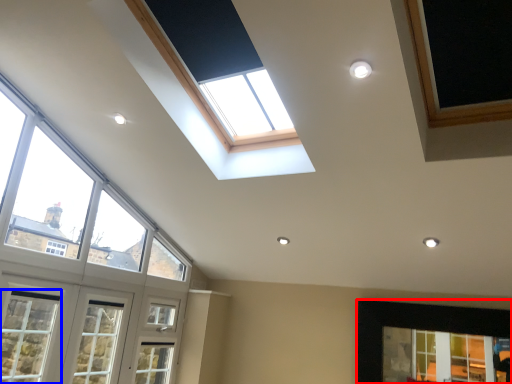
Question: Which point is closer to the camera, window (highlighted by a red box) or window (highlighted by a blue box)?

Choices:
 (A) window
 (B) window

Answer: (B)